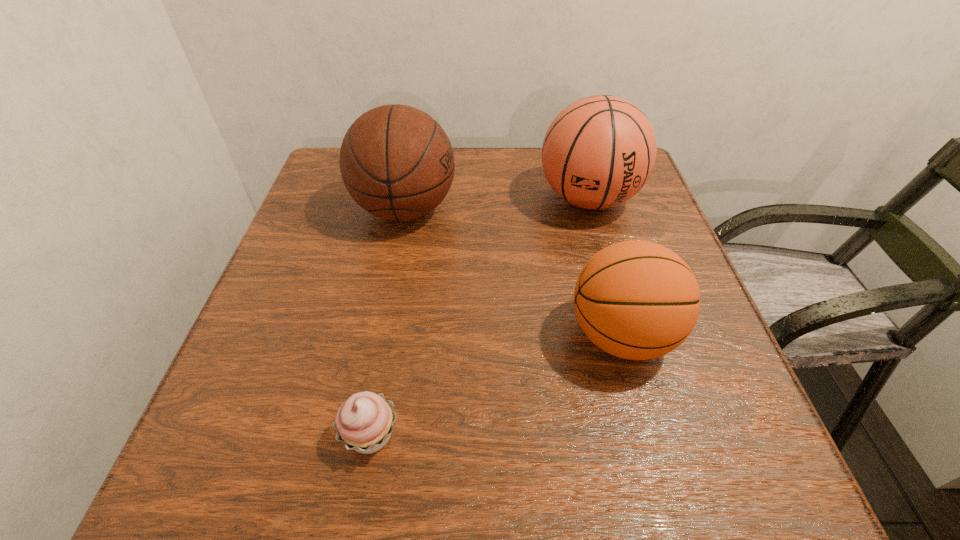
Identify the location of the leftmost basketball. (397, 163).

Find the location of a particular element. The image size is (960, 540). the nearest basketball is located at coordinates (638, 300).

Find the location of `the third tallest object`. the third tallest object is located at coordinates (638, 300).

Where is `the nearest object`? the nearest object is located at coordinates pyautogui.click(x=364, y=422).

Where is `the shortest object`? the shortest object is located at coordinates (364, 422).

This screenshot has width=960, height=540. What are the coordinates of `blank space located 0.260m on the side with brand label of the leftmost basketball` in the screenshot? It's located at (568, 210).

Locate an element on the screen. vacant position located on the front of the nearest basketball is located at coordinates (665, 495).

At what (x,y) coordinates should I click in order to perform the action: click on free point located on the right of the shortest object. Please return your answer as a coordinate pair (x, y). The height and width of the screenshot is (540, 960). Looking at the image, I should click on (564, 435).

Identify the location of object present at the near edge. 364,422.

Locate an element on the screen. This screenshot has width=960, height=540. object located in the left edge section of the desktop is located at coordinates (397, 163).